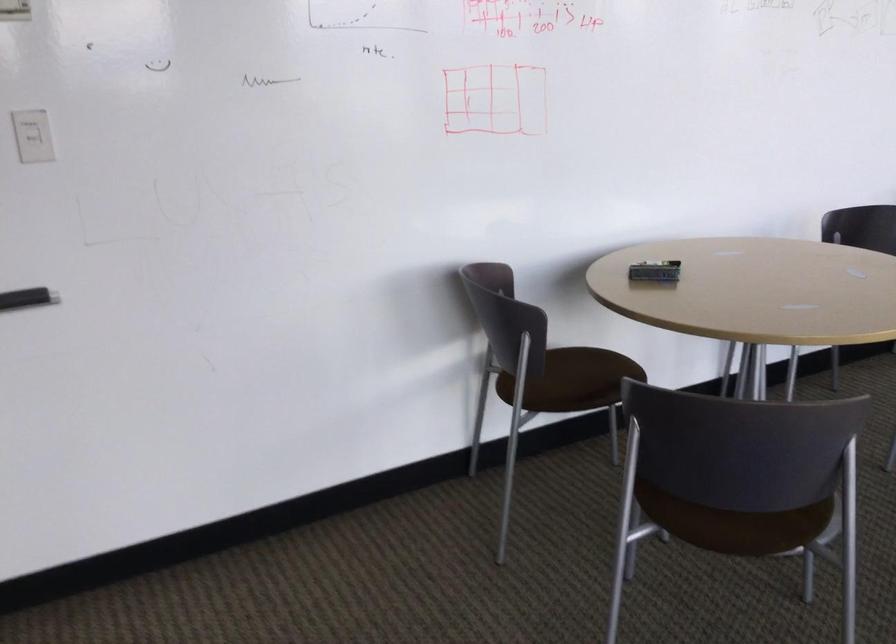
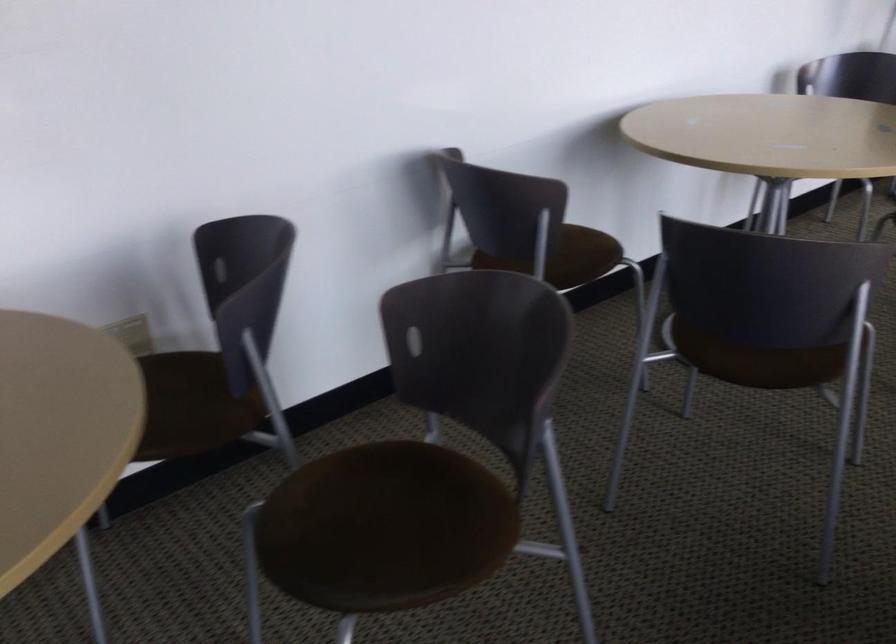
Which direction would the cameraman need to move to produce the second image?

The cameraman moved toward right, forward.